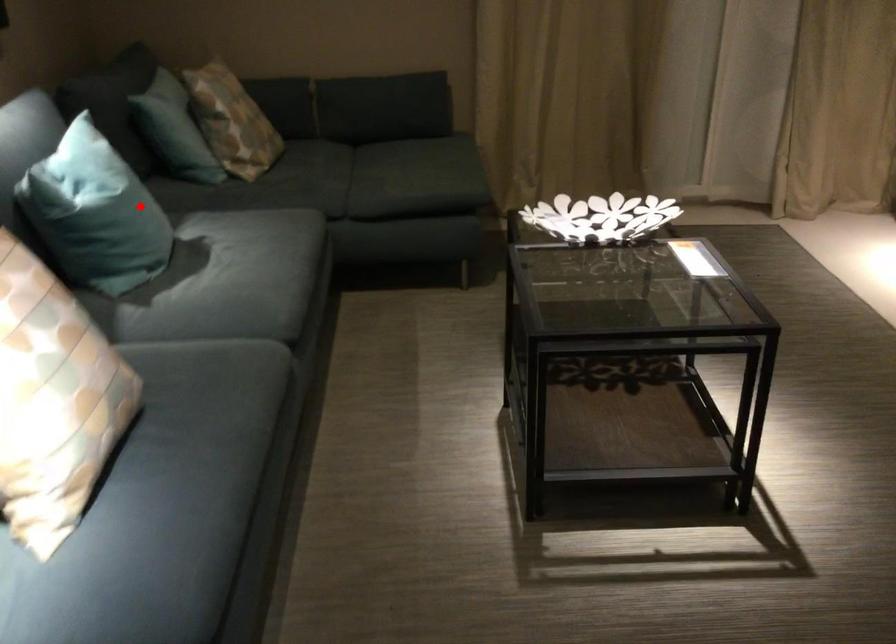
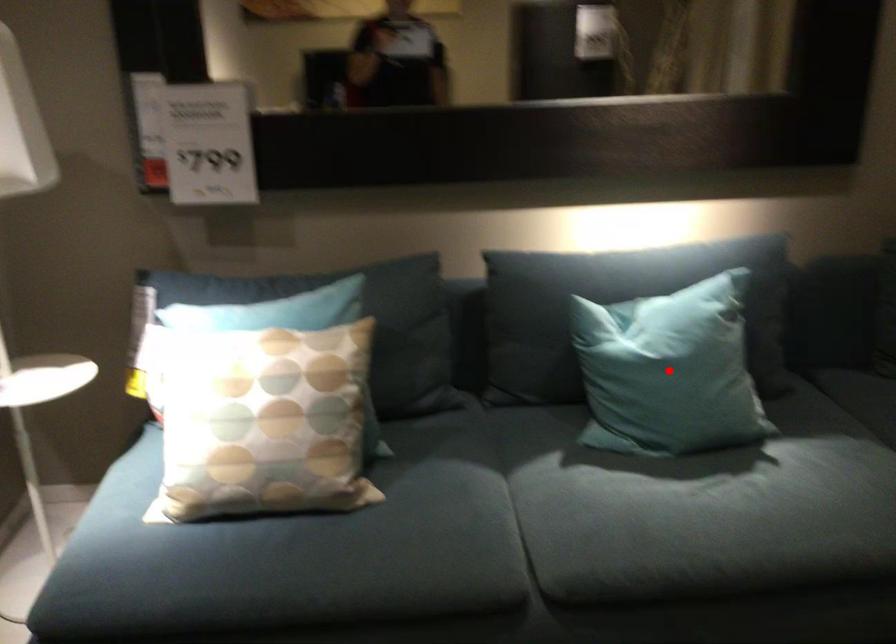
I am providing you with two images of the same scene from different viewpoints. A red point is marked on the first image and another point is marked on the second image. Do the highlighted points in image1 and image2 indicate the same real-world spot?

Yes